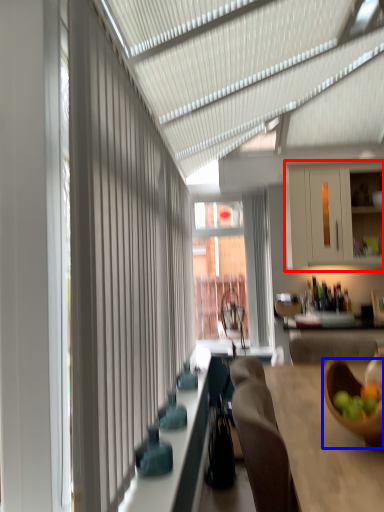
Question: Which of the following is the farthest to the observer, cabinetry (highlighted by a red box) or bowl (highlighted by a blue box)?

Choices:
 (A) cabinetry
 (B) bowl

Answer: (A)